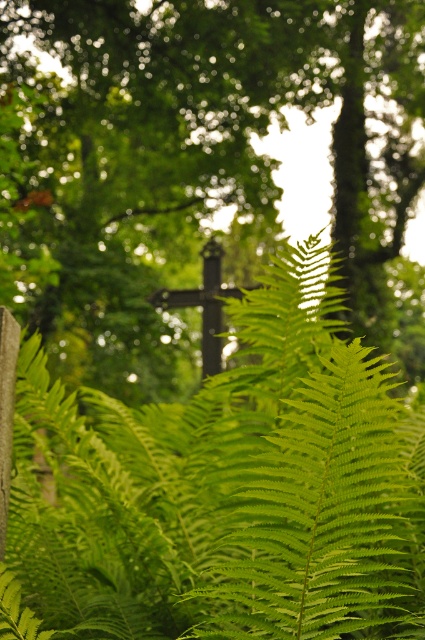
Question: Which of these objects is positioned farthest from the green leafy fern at lower center?

Choices:
 (A) dark brown wooden cross at center
 (B) green leafy fern at center

Answer: (B)

Question: Is green leafy fern at lower center smaller than dark brown wooden cross at center?

Choices:
 (A) no
 (B) yes

Answer: (A)

Question: Where is green leafy fern at lower center located in relation to dark brown wooden cross at center in the image?

Choices:
 (A) right
 (B) left

Answer: (A)

Question: Which point is closer to the camera taking this photo?

Choices:
 (A) (212, 320)
 (B) (161, 138)
 (C) (413, 477)

Answer: (C)

Question: Can you confirm if green leafy fern at lower center is positioned to the left of dark brown wooden cross at center?

Choices:
 (A) yes
 (B) no

Answer: (B)

Question: Which point is farther to the camera?

Choices:
 (A) dark brown wooden cross at center
 (B) green leafy fern at lower center

Answer: (B)